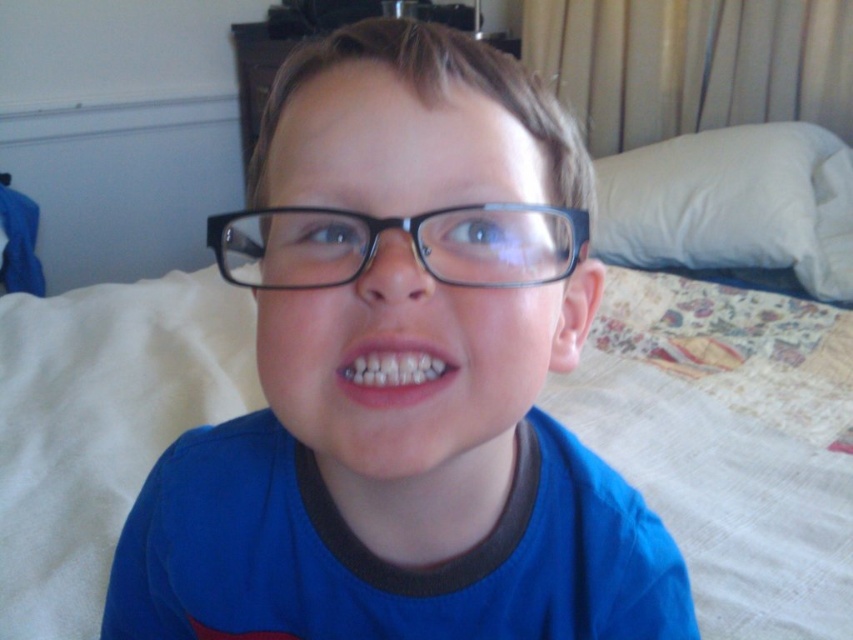
Which is in front, point (589, 180) or point (602, 224)?

Positioned in front is point (589, 180).

Is blue matte shirt at center smaller than white soft pillow at right?

Indeed, blue matte shirt at center has a smaller size compared to white soft pillow at right.

Which is in front, point (331, 612) or point (843, 285)?

Point (331, 612)

This screenshot has height=640, width=853. I want to click on blue matte shirt at center, so click(405, 404).

Which is in front, point (457, 452) or point (219, 244)?

Point (457, 452) is more forward.

Between blue matte shirt at center and black plastic glasses at center, which one is positioned higher?

black plastic glasses at center is higher up.

Which is behind, point (257, 630) or point (531, 232)?

Point (257, 630)

What are the coordinates of `blue matte shirt at center` in the screenshot? It's located at (405, 404).

Which of these two, white soft pillow at right or black plastic glasses at center, stands taller?

white soft pillow at right

Can you confirm if white soft pillow at right is bigger than black plastic glasses at center?

Yes, white soft pillow at right is bigger than black plastic glasses at center.

Does point (761, 208) come behind point (312, 241)?

That is True.

This screenshot has width=853, height=640. I want to click on white soft pillow at right, so click(733, 204).